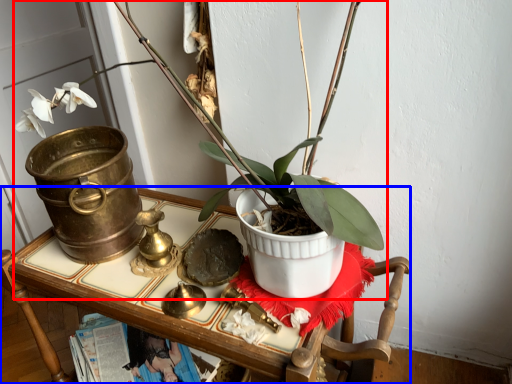
Question: Which object appears farthest to the camera in this image, houseplant (highlighted by a red box) or furniture (highlighted by a blue box)?

Choices:
 (A) houseplant
 (B) furniture

Answer: (B)